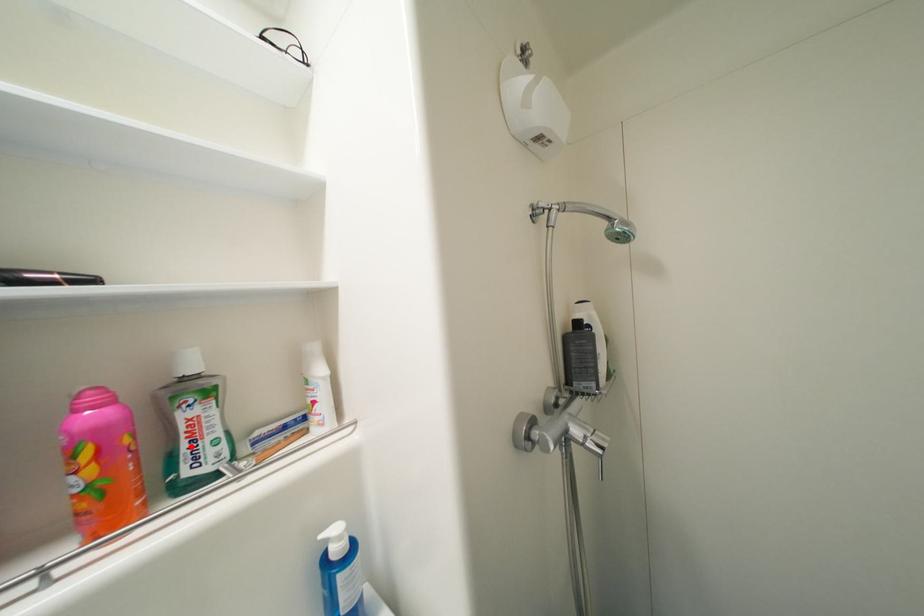
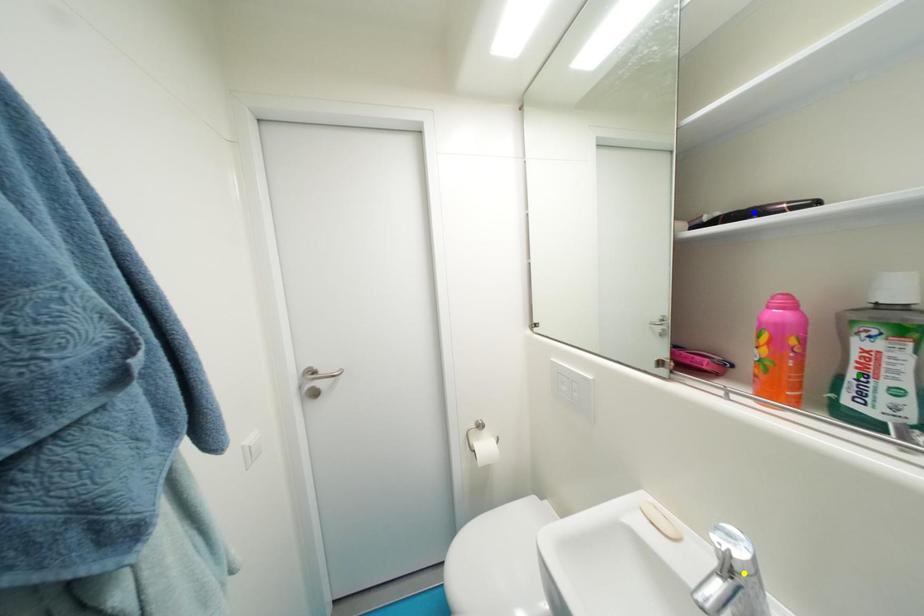
Question: I am providing you with two images of the same scene from different viewpoints. A red point is marked on the first image. You are given multiple points on the second image. Which point in image 2 is actually the same real-world point as the red point in image 1?

Choices:
 (A) green point
 (B) yellow point
 (C) blue point

Answer: (A)